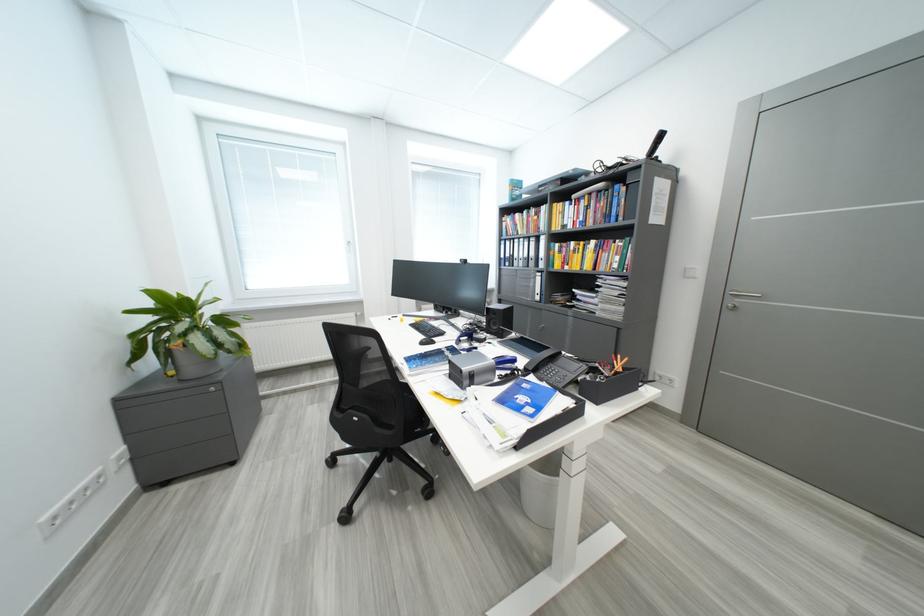
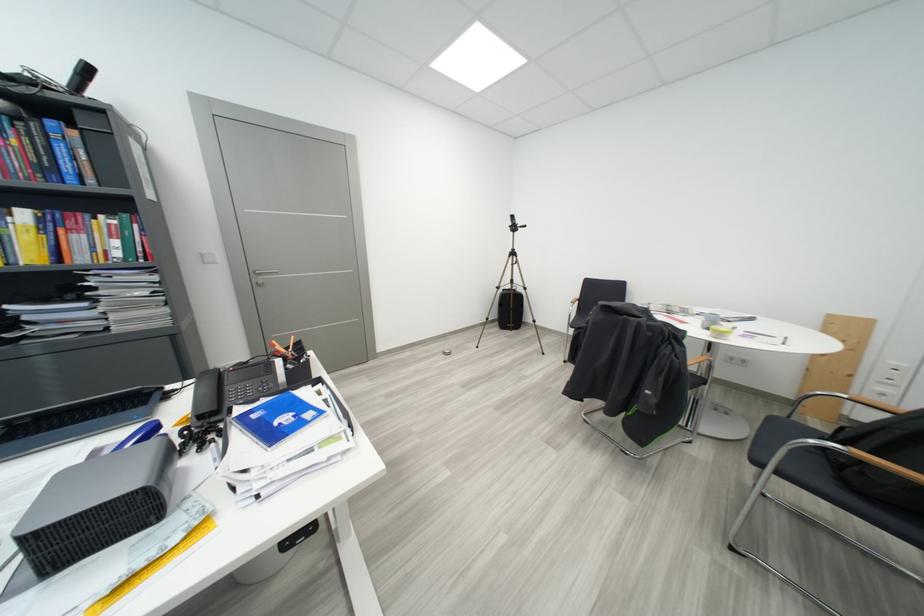
Where in the second image is the point corresponding to point 626,261 from the first image?

(126, 245)